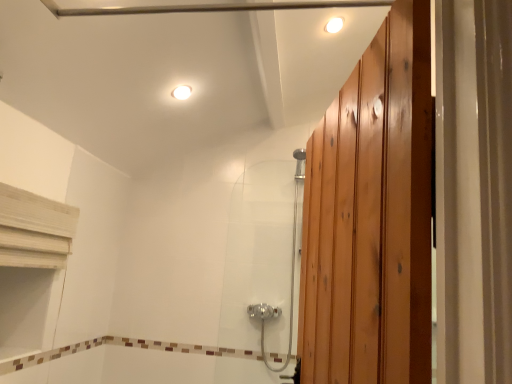
Question: In the image, is satin chrome shower door at center on the left side or the right side of white glossy light fixture at upper center, positioned as the 2th light fixture in right-to-left order?

Choices:
 (A) left
 (B) right

Answer: (B)

Question: From the image's perspective, relative to white glossy light fixture at upper center, which ranks as the second light fixture in top-to-bottom order, is satin chrome shower door at center above or below?

Choices:
 (A) below
 (B) above

Answer: (A)

Question: Based on their relative distances, which object is farther from the white glossy light fixture at upper center, positioned as the 2th light fixture in right-to-left order?

Choices:
 (A) white glossy light fixture at upper center, the 2th light fixture in the bottom-to-top sequence
 (B) satin chrome shower door at center

Answer: (B)

Question: Estimate the real-world distances between objects in this image. Which object is farther from the white glossy light fixture at upper center, the first light fixture in the right-to-left sequence?

Choices:
 (A) white glossy light fixture at upper center, positioned as the 2th light fixture in right-to-left order
 (B) satin chrome shower door at center

Answer: (B)